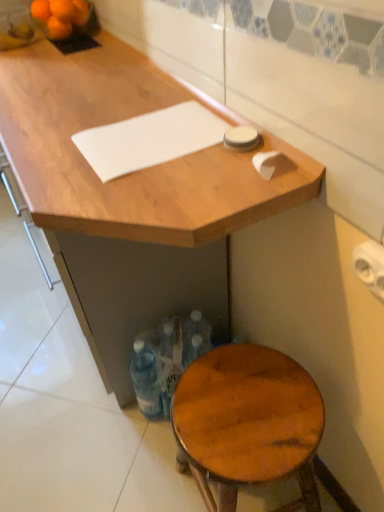
This screenshot has height=512, width=384. I want to click on vacant area on the back side of white matte cutting board at upper center, so click(x=131, y=98).